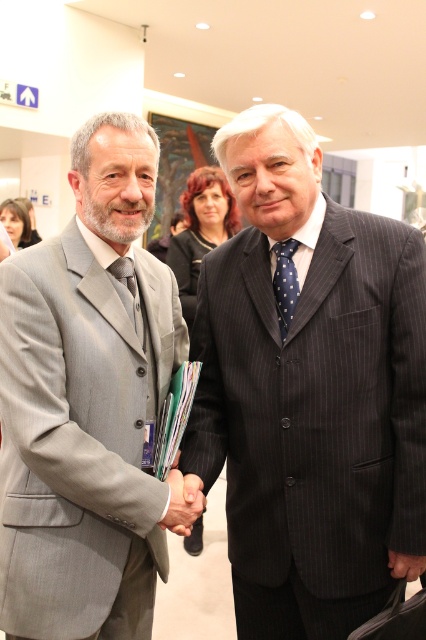
You are a photographer at a professional event. You need to place a small microphone stand between the pinstriped suit at center and the matte gray suit at left. Given that the microphone stand requires 0.5 meters of space, can you fit it between them?

The pinstriped suit at center is larger in size compared to the matte gray suit at left. However, the exact distance between them isn

You are an observer at the scene. Which object is located to the right of the other between the pinstriped suit at center and the matte black hand at center?

The pinstriped suit at center is located to the right of the matte black hand at center.

You are a photographer setting up for a formal event. You need to ensure that the pinstriped suit at center and the matte black tie at center are both visible in the frame. Given their sizes, which object should you focus on to ensure both are clearly captured?

The pinstriped suit at center is larger in size than the matte black tie at center, so focusing on the pinstriped suit at center will help ensure both objects are clearly visible in the frame.